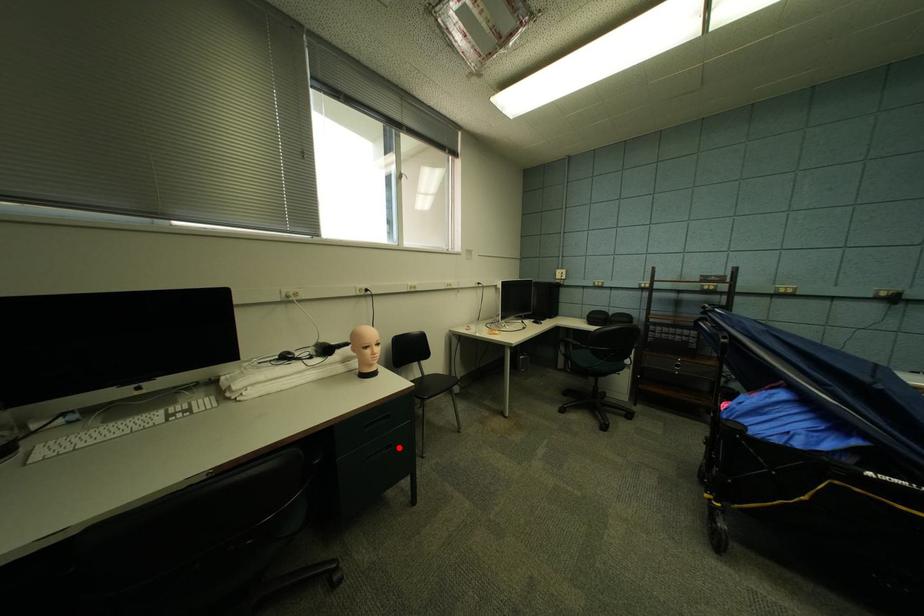
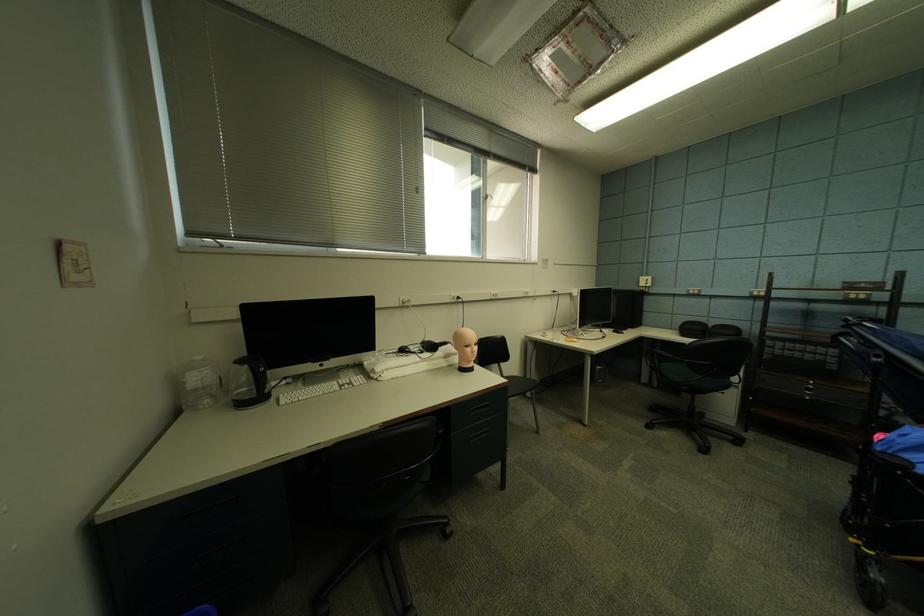
Question: I am providing you with two images of the same scene from different viewpoints. A red point is shown in image1. For the corresponding object point in image2, is it positioned nearer or farther from the camera?

Choices:
 (A) Nearer
 (B) Farther

Answer: (B)